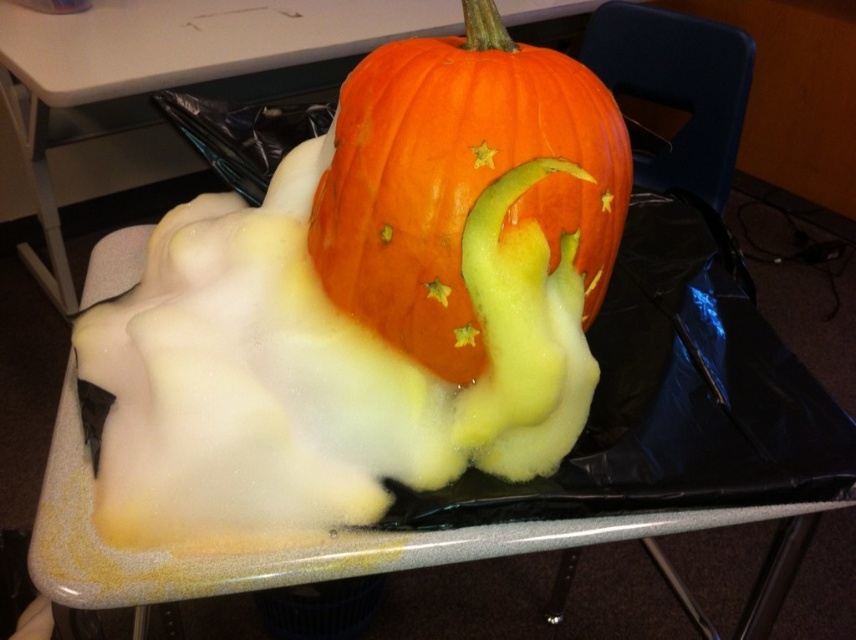
Question: Does orange matte pumpkin at center lie in front of smooth plastic table at center?

Choices:
 (A) no
 (B) yes

Answer: (B)

Question: Is the position of orange matte pumpkin at center less distant than that of smooth plastic table at center?

Choices:
 (A) yes
 (B) no

Answer: (A)

Question: Which point appears farthest from the camera in this image?

Choices:
 (A) (401, 1)
 (B) (440, 200)

Answer: (A)

Question: Which of the following is the closest to the observer?

Choices:
 (A) (388, 316)
 (B) (138, 68)

Answer: (A)

Question: Which object appears closest to the camera in this image?

Choices:
 (A) smooth plastic table at center
 (B) orange matte pumpkin at center

Answer: (B)

Question: Does orange matte pumpkin at center appear on the right side of smooth plastic table at center?

Choices:
 (A) yes
 (B) no

Answer: (A)